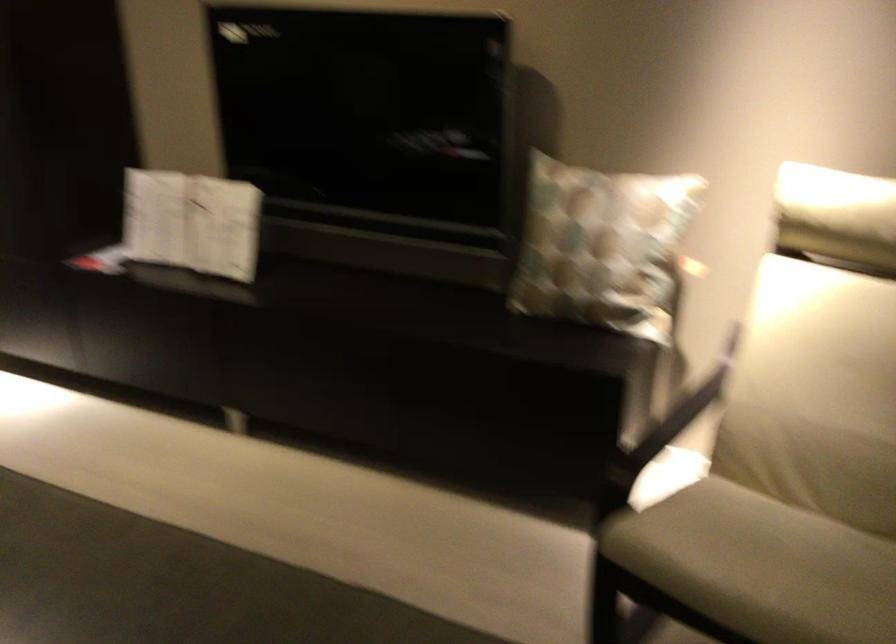
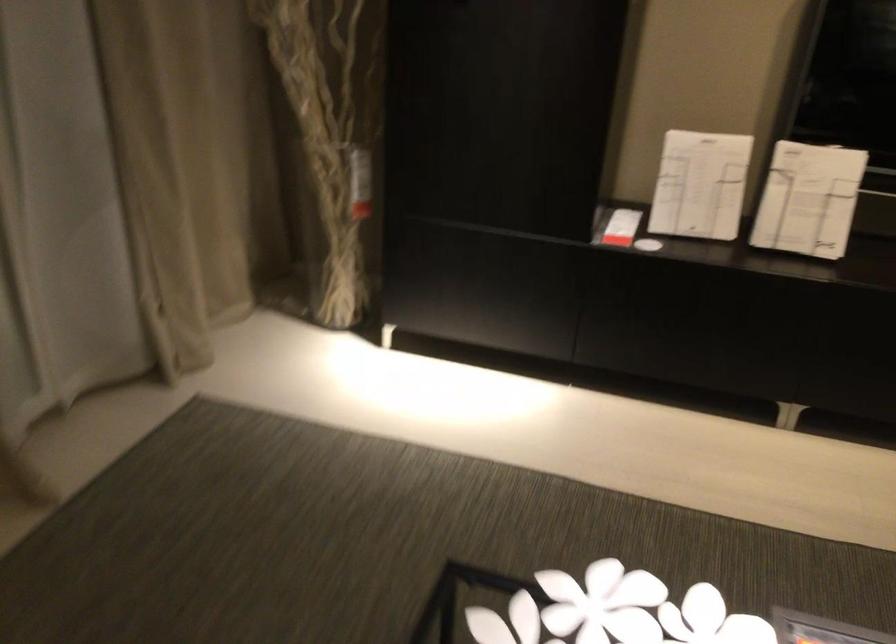
Find the pixel in the second image that matches (x=152, y=220) in the first image.

(700, 185)